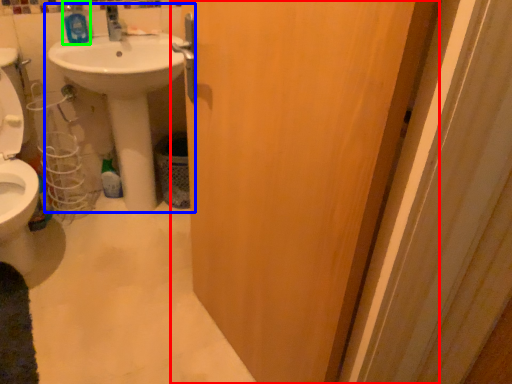
Question: Considering the real-world distances, which object is closest to door (highlighted by a red box)? sink (highlighted by a blue box) or mouthwash (highlighted by a green box).

Choices:
 (A) sink
 (B) mouthwash

Answer: (A)